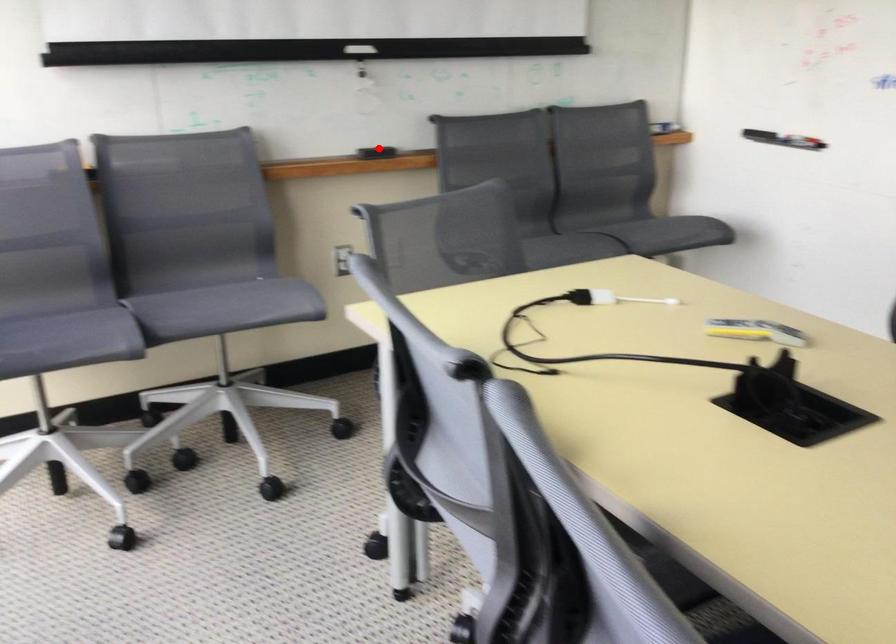
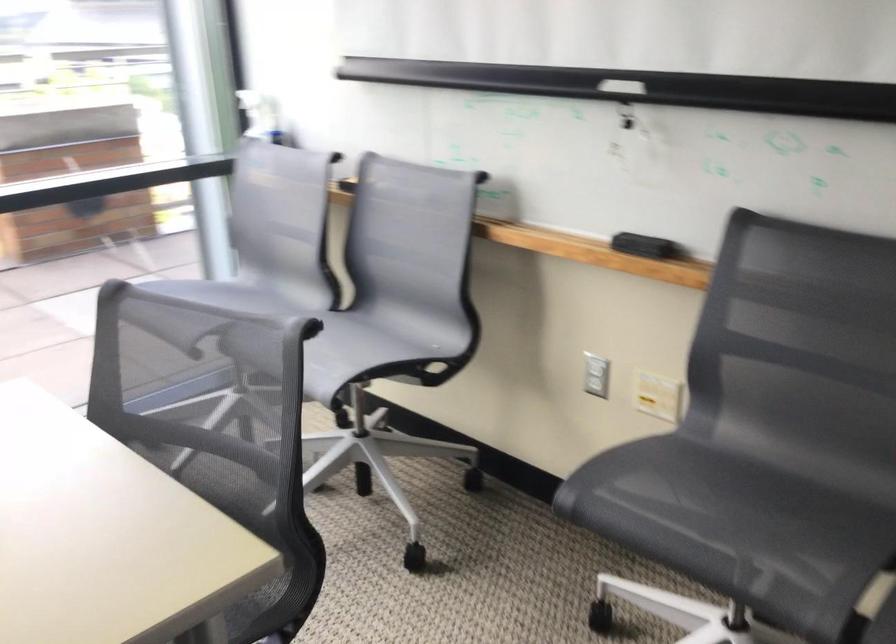
The point at the highlighted location is marked in the first image. Where is the corresponding point in the second image?

(643, 245)